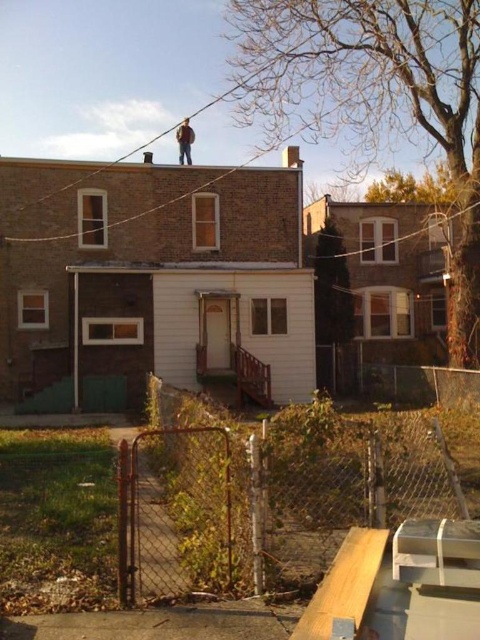
Question: Which point appears closest to the camera in this image?

Choices:
 (A) (382, 240)
 (B) (348, 452)
 (C) (187, 131)

Answer: (B)

Question: Is rusty chain-link fence at lower center below brown leather jacket at upper center?

Choices:
 (A) no
 (B) yes

Answer: (B)

Question: Which object is positioned farthest from the rusty chain-link fence at lower center?

Choices:
 (A) black wire at upper center
 (B) brown leather jacket at upper center

Answer: (B)

Question: Which point is closer to the camera?

Choices:
 (A) (410, 515)
 (B) (183, 144)
 (C) (352, 253)

Answer: (A)

Question: Does rusty chain-link fence at lower center have a greater width compared to brown leather jacket at upper center?

Choices:
 (A) yes
 (B) no

Answer: (B)

Question: Does rusty chain-link fence at lower center come in front of brown leather jacket at upper center?

Choices:
 (A) yes
 (B) no

Answer: (A)